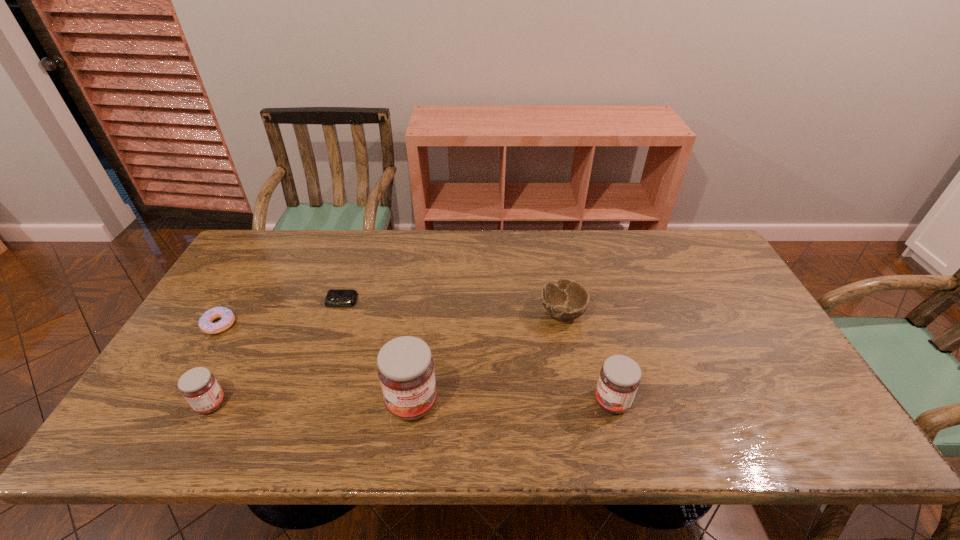
The height and width of the screenshot is (540, 960). In order to click on free space at the far edge of the desktop in this screenshot , I will do `click(453, 234)`.

Where is `vacant region at the left edge of the desktop`? This screenshot has width=960, height=540. vacant region at the left edge of the desktop is located at coordinates (222, 300).

Where is `vacant space at the right edge`? Image resolution: width=960 pixels, height=540 pixels. vacant space at the right edge is located at coordinates (765, 333).

Image resolution: width=960 pixels, height=540 pixels. Find the location of `free space at the far right corner`. free space at the far right corner is located at coordinates (698, 271).

In the image, there is a desktop. Where is `free space at the near right corner`? The width and height of the screenshot is (960, 540). free space at the near right corner is located at coordinates (752, 388).

Where is `vacant region between the second shortest jam and the tallest jam`? vacant region between the second shortest jam and the tallest jam is located at coordinates (512, 402).

This screenshot has height=540, width=960. I want to click on vacant space in between the leftmost object and the third object from left to right, so click(280, 313).

Identify the location of free space between the leftmost object and the fourth object from left to right. The image size is (960, 540). (316, 364).

Image resolution: width=960 pixels, height=540 pixels. What are the coordinates of `free area in between the doughnut and the second object from left to right` in the screenshot? It's located at (215, 364).

Image resolution: width=960 pixels, height=540 pixels. I want to click on free space between the bowl and the second shortest jam, so click(587, 357).